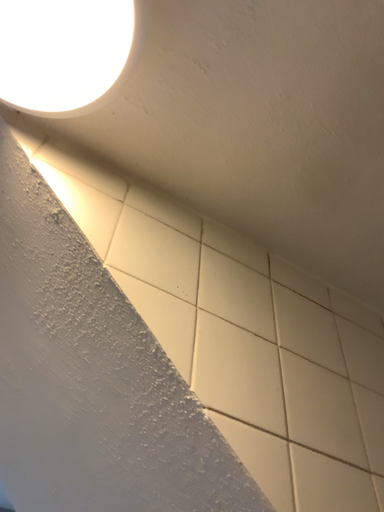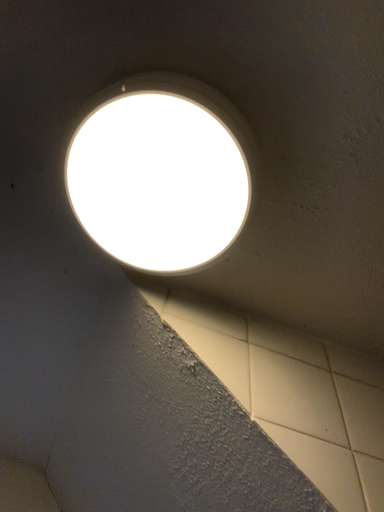
Question: How did the camera likely rotate when shooting the video?

Choices:
 (A) rotated left
 (B) rotated right

Answer: (A)